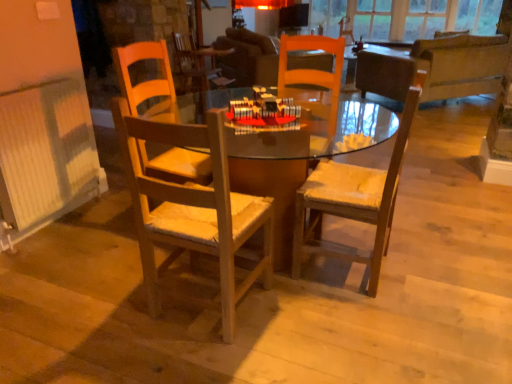
Locate an element on the screen. Image resolution: width=512 pixels, height=384 pixels. vacant space in front of wooden chair with cushion at center, which is the first chair from right to left is located at coordinates (x=366, y=317).